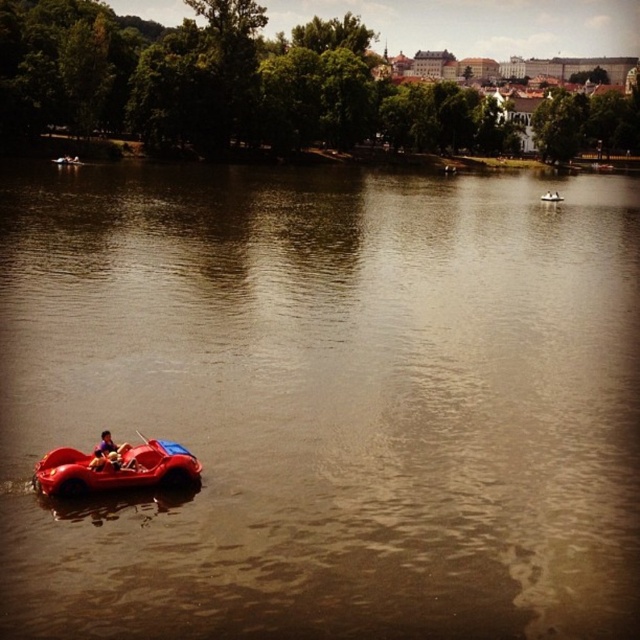
You are standing at the point marked by coordinates point (106, 444). Looking around, you see a smooth plastic paddle boat at lower left. Which direction should you move to reach the smooth plastic paddle boat at lower left?

The point (106, 444) is already at the smooth plastic paddle boat at lower left, so you are already there.

You are standing at the center of the image and want to take a photo of the shiny red car at lower left without including the small red pedal boat with a blue roof in the middle ground. Is the car positioned far enough to the left to avoid the boat appearing in the frame?

The shiny red car at lower left is located at point (116, 468), which places it far enough to the left to avoid the small red pedal boat with a blue roof in the middle ground from appearing in the photo.

You are a photographer trying to capture the red rubber boat at lower left and the matte red pedal boat at center in a single frame. Based on their positions, which boat will appear closer to the camera in your photo?

The red rubber boat at lower left appears closer to the camera because it is positioned over the matte red pedal boat at center.